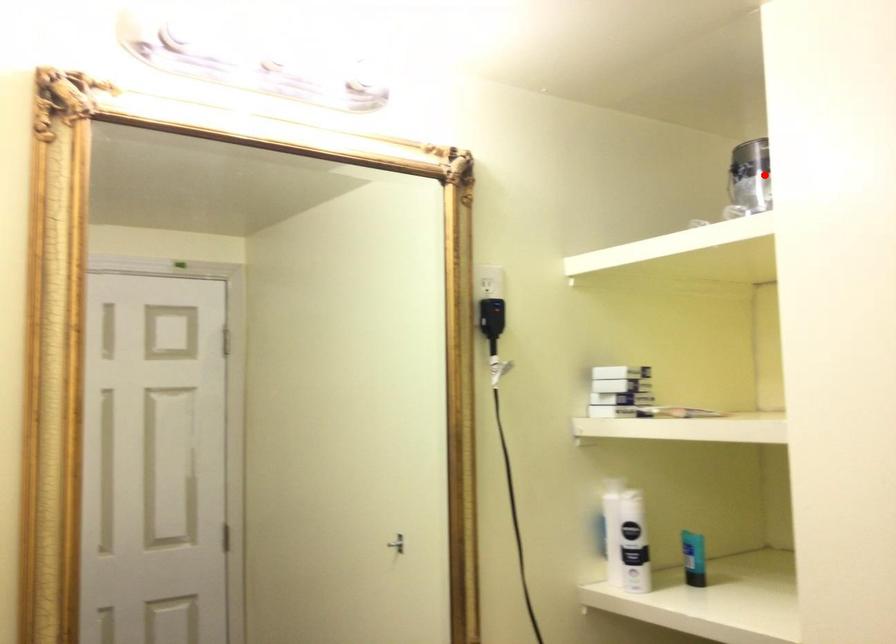
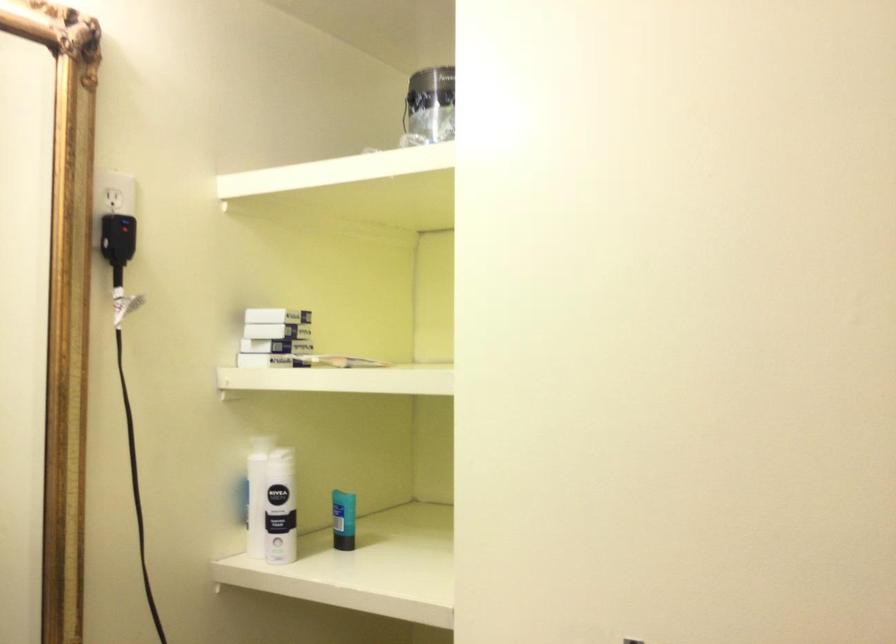
Where in the second image is the point corresponding to the highlighted location from the first image?

(428, 106)